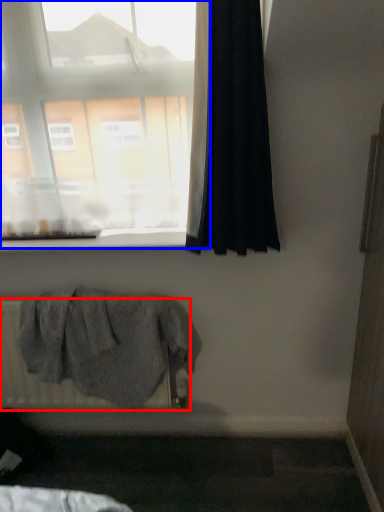
Question: Which of the following is the farthest to the observer, radiator (highlighted by a red box) or window (highlighted by a blue box)?

Choices:
 (A) radiator
 (B) window

Answer: (A)